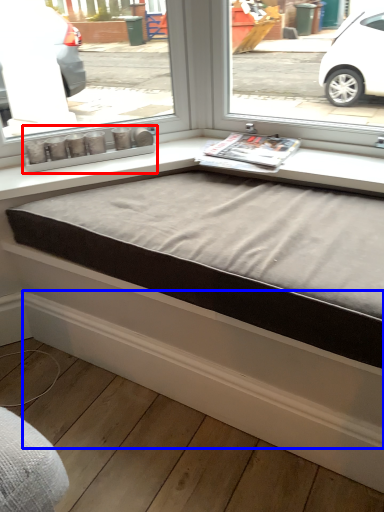
Question: Which object is further to the camera taking this photo, window box (highlighted by a red box) or curb (highlighted by a blue box)?

Choices:
 (A) window box
 (B) curb

Answer: (A)